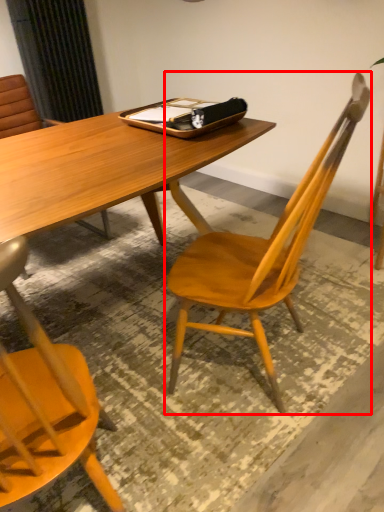
Question: Where is chair (annotated by the red box) located in relation to tray in the image?

Choices:
 (A) left
 (B) right

Answer: (B)